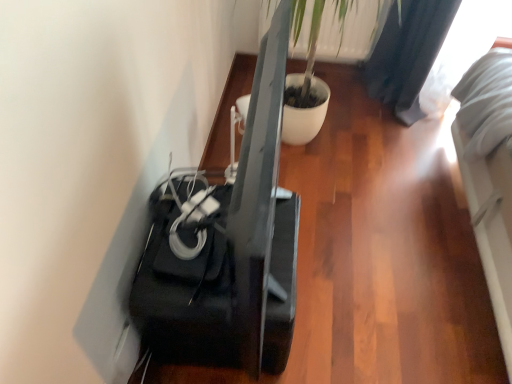
The height and width of the screenshot is (384, 512). I want to click on vacant area that lies to the right of black glossy speaker at lower left, so click(342, 304).